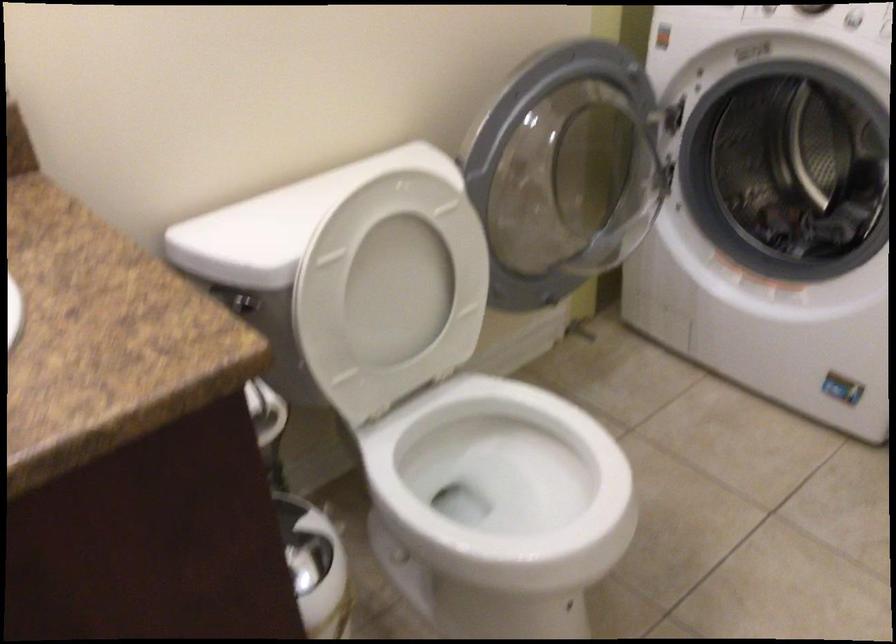
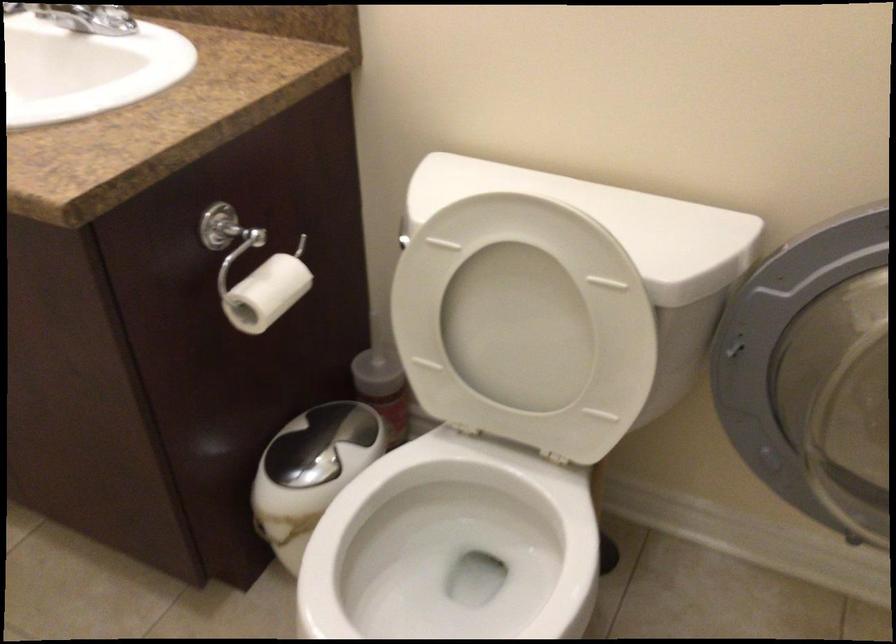
In the second image, find the point that corresponds to (x=444, y=516) in the first image.

(449, 564)